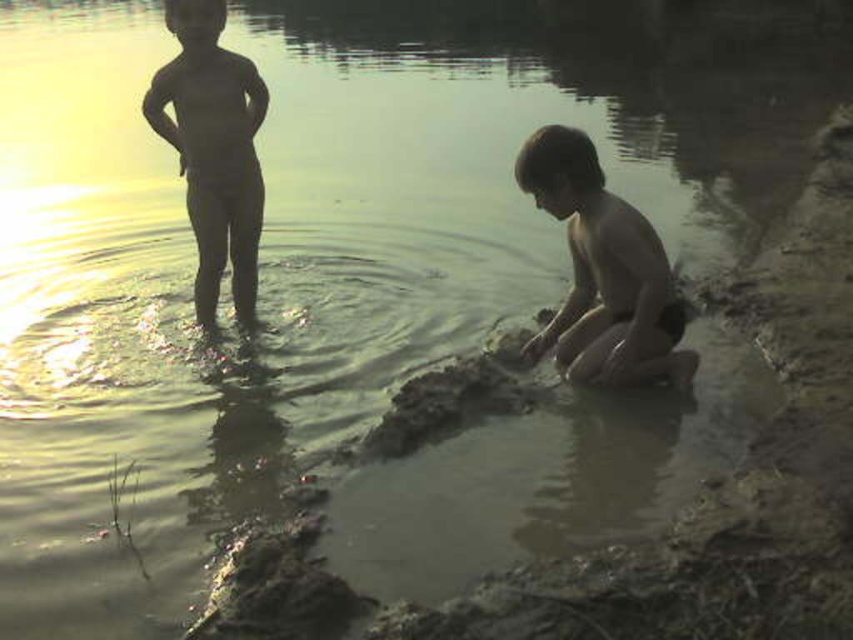
Which of these two, smooth skin boy at lower right or smooth skin child at left, stands shorter?

With less height is smooth skin boy at lower right.

Who is higher up, smooth skin boy at lower right or smooth skin child at left?

smooth skin child at left is higher up.

The image size is (853, 640). Identify the location of smooth skin boy at lower right. (602, 272).